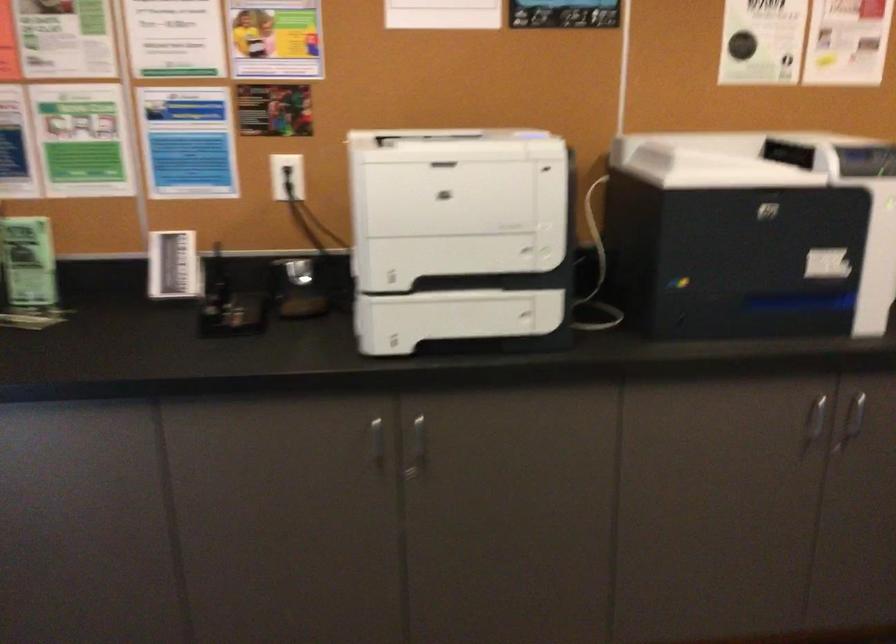
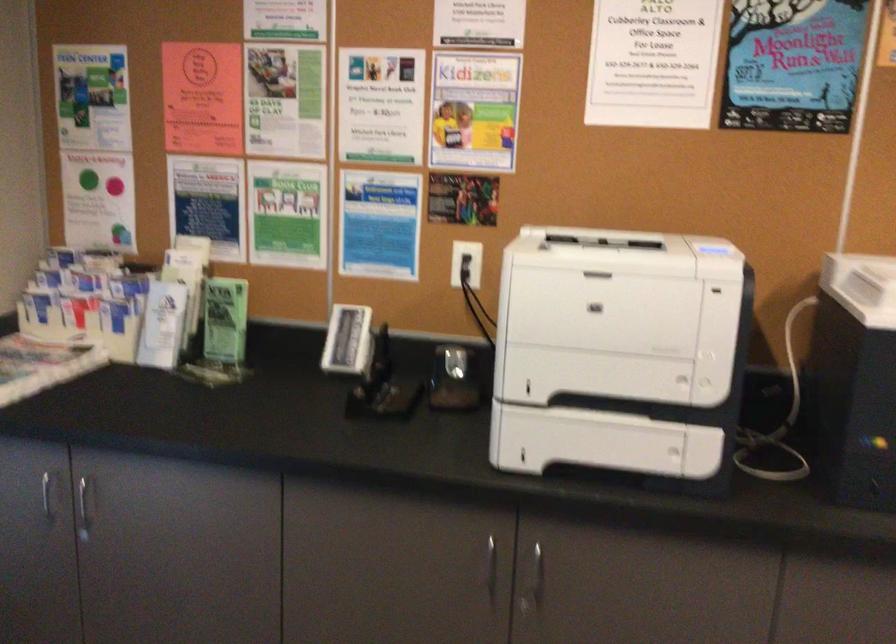
Which direction would the cameraman need to move to produce the second image?

The movement direction of the cameraman is right, forward.